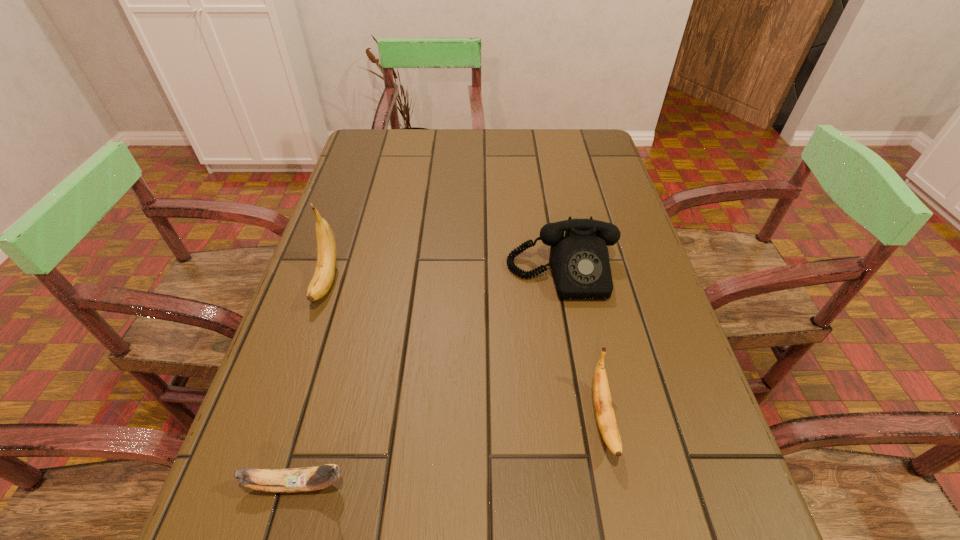
I want to click on object present at the right edge, so click(579, 261).

At what (x,y) coordinates should I click in order to perform the action: click on vacant space at the far edge of the desktop. Please return your answer as a coordinate pair (x, y). Image resolution: width=960 pixels, height=540 pixels. Looking at the image, I should click on (467, 152).

In the image, there is a desktop. Identify the location of vacant space at the left edge. (274, 450).

This screenshot has width=960, height=540. I want to click on free location at the right edge, so click(576, 216).

Identify the location of blank space at the far left corner of the desktop. The width and height of the screenshot is (960, 540). (372, 132).

Where is `free space between the second tallest object and the farthest banana`? The height and width of the screenshot is (540, 960). free space between the second tallest object and the farthest banana is located at coordinates (444, 278).

Find the location of a particular element. The width and height of the screenshot is (960, 540). free space that is in between the rightmost banana and the third shortest object is located at coordinates (583, 346).

Where is `free space between the farthest banana and the telephone`? The width and height of the screenshot is (960, 540). free space between the farthest banana and the telephone is located at coordinates (444, 278).

This screenshot has width=960, height=540. I want to click on free space between the nearest object and the rightmost banana, so coord(450,451).

Locate an element on the screen. The width and height of the screenshot is (960, 540). free space between the nearest banana and the tallest banana is located at coordinates (312, 383).